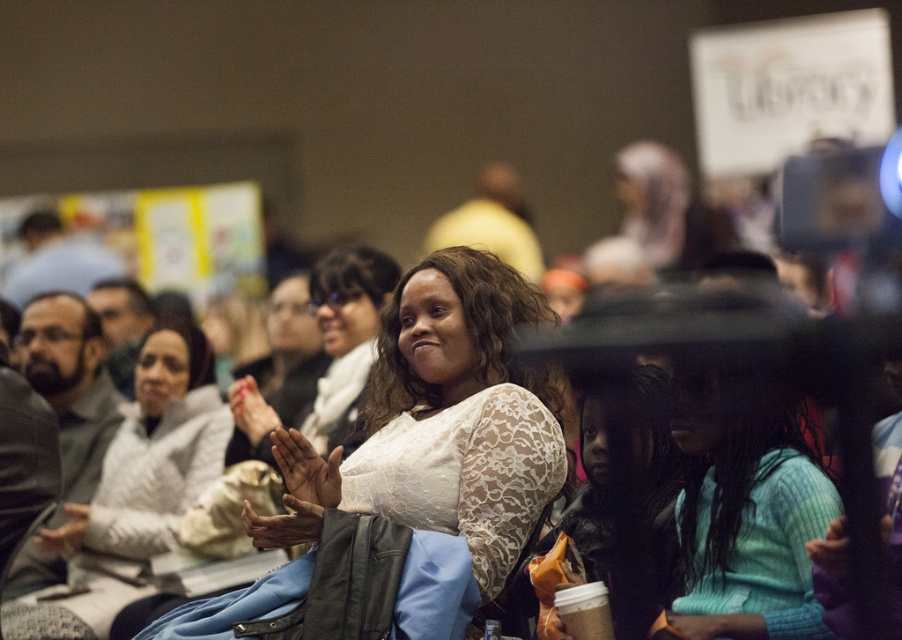
You are a photographer at the event and want to ensure both the white lace blouse at center and the teal knitted sweater at center are clearly visible in your photo. Which clothing item should you focus on to capture both without one being too small in the frame?

The white lace blouse at center is taller than the teal knitted sweater at center. To capture both clearly, focus on the white lace blouse at center as it is larger and ensure the frame includes the teal knitted sweater at center positioned below it.

You are a photographer at the event and want to take a closeup of the white lace blouse at center and the teal knitted sweater at center. Which one will appear larger in the photo?

The white lace blouse at center will appear larger in the photo because it is closer to the viewer than the teal knitted sweater at center.

You are a photographer adjusting your camera settings to focus on the teal knitted sweater at center and the white lace shirt at center. Which object should you adjust your focus to first to ensure both are in sharp focus?

The teal knitted sweater at center is closer to the viewer than the white lace shirt at center. To ensure both are in sharp focus, adjust the focus starting with the teal knitted sweater at center first, then the white lace shirt at center, as focusing on the closer object first helps in achieving depth of field for both.